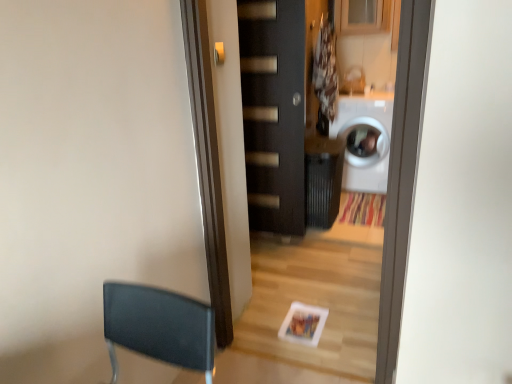
Question: In terms of width, does satin silver door handle at upper center look wider or thinner when compared to matte black door at center?

Choices:
 (A) thin
 (B) wide

Answer: (A)

Question: Looking at the image, does satin silver door handle at upper center seem bigger or smaller compared to matte black door at center?

Choices:
 (A) big
 (B) small

Answer: (B)

Question: Estimate the real-world distances between objects in this image. Which object is closer to the matte black door at center?

Choices:
 (A) satin silver door handle at upper center
 (B) white glossy washing machine at right

Answer: (B)

Question: Which of these objects is positioned closest to the white glossy washing machine at right?

Choices:
 (A) satin silver door handle at upper center
 (B) matte black door at center

Answer: (B)